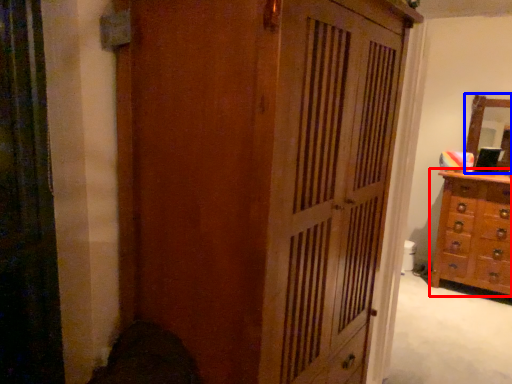
Question: Which point is closer to the camera, chest of drawers (highlighted by a red box) or mirror (highlighted by a blue box)?

Choices:
 (A) chest of drawers
 (B) mirror

Answer: (A)